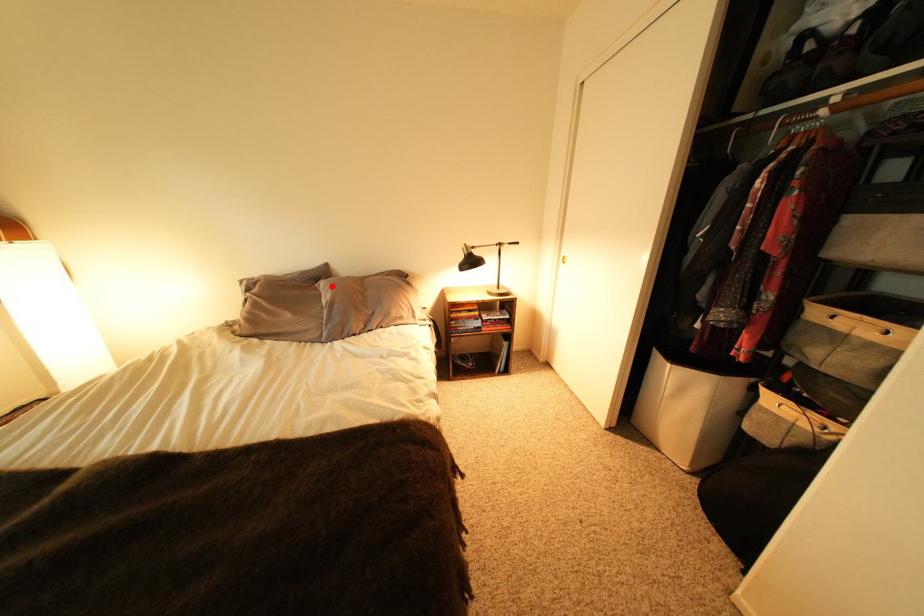
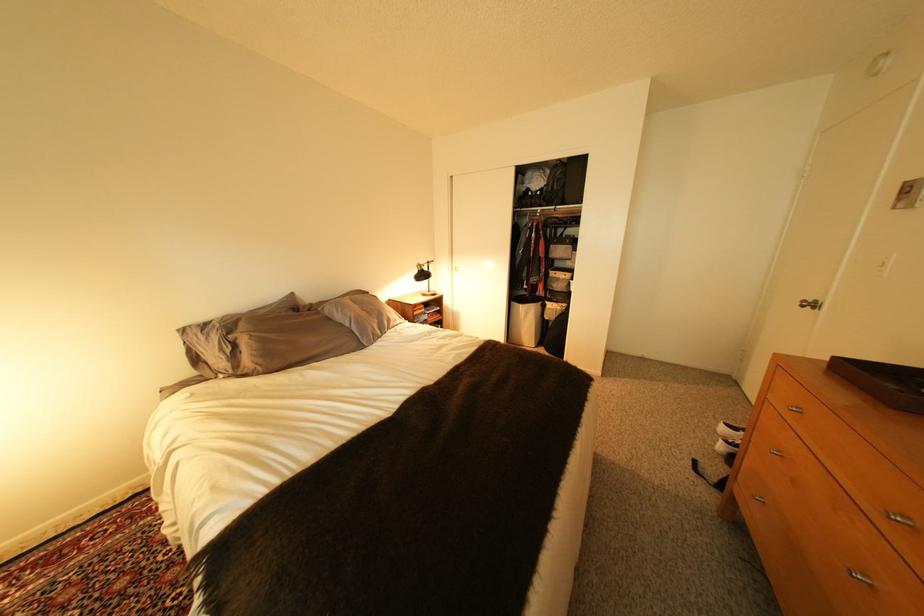
In the second image, find the point that corresponds to the highlighted location in the first image.

(335, 310)